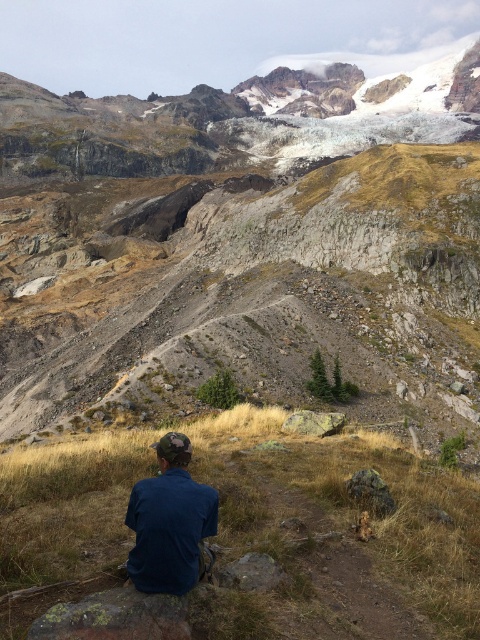
You are a hiker trying to decide between two paths. One leads to the rugged rock mountain at center and the other to the brown grassy hillside at lower center. Which path would you take if you want to reach a larger elevation?

You should take the path to the rugged rock mountain at center because it is larger in size than the brown grassy hillside at lower center, indicating a higher elevation.

You are a hiker who wants to take a photo of the rugged rock mountain at center and the blue denim shirt at lower center. Which object should you focus on first if you want to include both in your photo without moving the camera?

The rugged rock mountain at center is positioned on the left side of blue denim shirt at lower center, so you should focus on the rugged rock mountain at center first to ensure both are in frame without moving the camera.

From the picture: You are a hiker who wants to take a photo of both the rugged rock mountain at center and the brown grassy hillside at lower center. Which object should you position to your left side to include both in the frame?

You should position the rugged rock mountain at center to your left side because it is already on the left side of the brown grassy hillside at lower center, allowing both to be captured in the photo.